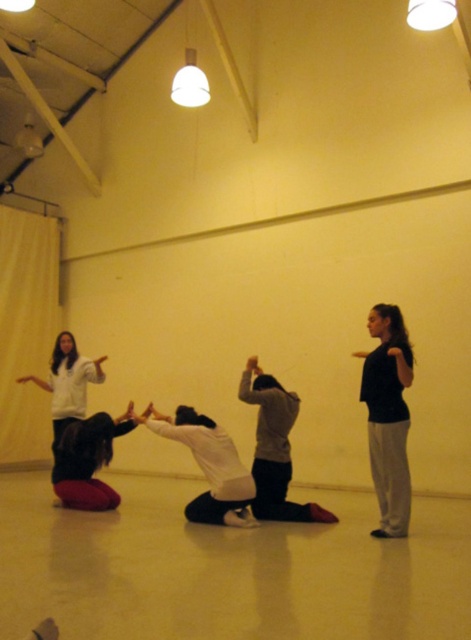
Is black matte shirt at right below white matte squat at center?

Incorrect, black matte shirt at right is not positioned below white matte squat at center.

Is point (407, 468) farther from camera compared to point (178, 419)?

No, it is in front of (178, 419).

Is point (375, 332) farther from camera compared to point (243, 493)?

No, (375, 332) is in front of (243, 493).

At what (x,y) coordinates should I click in order to perform the action: click on black matte shirt at right. Please return your answer as a coordinate pair (x, y). Looking at the image, I should click on (388, 417).

Where is `white matte squat at center`? This screenshot has height=640, width=471. white matte squat at center is located at coordinates (x=210, y=467).

Does white matte squat at center have a lesser height compared to dark gray fabric squat at center?

Yes.

The height and width of the screenshot is (640, 471). What do you see at coordinates (210, 467) in the screenshot? I see `white matte squat at center` at bounding box center [210, 467].

The width and height of the screenshot is (471, 640). Identify the location of white matte squat at center. (210, 467).

Is point (394, 435) farther from camera compared to point (81, 477)?

No, (394, 435) is closer to viewer.

How far apart are black matte shirt at right and dark gray fabric squat at center?

They are 2.55 meters apart.

Is point (364, 385) positioned before point (90, 456)?

Yes.

Identify the location of black matte shirt at right. The height and width of the screenshot is (640, 471). (388, 417).